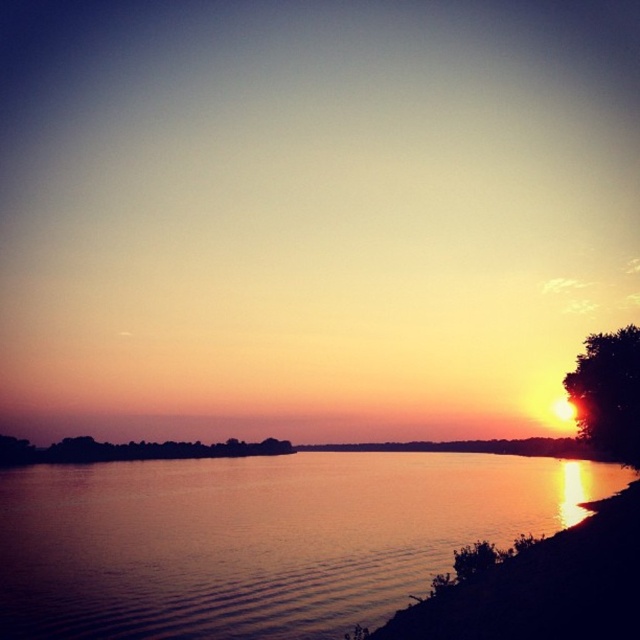
Can you confirm if silvery metallic tree at right is positioned to the right of green leafy tree at lower left?

Correct, you'll find silvery metallic tree at right to the right of green leafy tree at lower left.

Does silvery metallic tree at right have a lesser height compared to green leafy tree at lower left?

Yes, silvery metallic tree at right is shorter than green leafy tree at lower left.

Locate an element on the screen. silvery metallic tree at right is located at coordinates (608, 394).

Can you confirm if silky water at center is positioned to the left of silvery metallic tree at right?

Indeed, silky water at center is positioned on the left side of silvery metallic tree at right.

How distant is silky water at center from silvery metallic tree at right?

silky water at center is 46.20 meters away from silvery metallic tree at right.

Between point (376, 593) and point (632, 381), which one is positioned behind?

Positioned behind is point (632, 381).

This screenshot has width=640, height=640. In order to click on silky water at center in this screenshot , I will do `click(260, 538)`.

Is point (392, 483) behind point (202, 451)?

No, it is not.

Consider the image. Is silky water at center behind green leafy tree at lower left?

No, it is in front of green leafy tree at lower left.

Who is more distant from viewer, (304, 460) or (209, 445)?

Point (209, 445)

Find the location of a particular element. silky water at center is located at coordinates (260, 538).